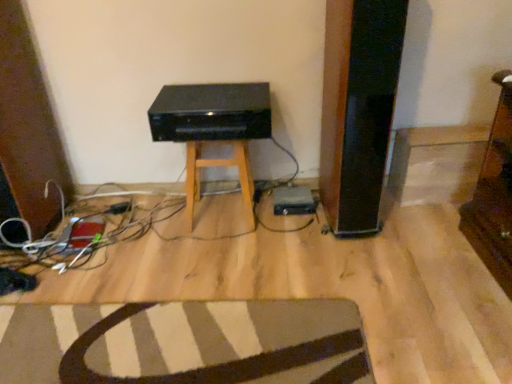
Question: In the image, is striped fabric rug at lower center on the left side or the right side of black plastic stereo at center?

Choices:
 (A) left
 (B) right

Answer: (A)

Question: Looking at the image, does striped fabric rug at lower center seem bigger or smaller compared to black plastic stereo at center?

Choices:
 (A) big
 (B) small

Answer: (B)

Question: Estimate the real-world distances between objects in this image. Which object is closer to the black plastic plug at lower left?

Choices:
 (A) striped fabric rug at lower center
 (B) black matte stool at center
 (C) black plastic stereo at center

Answer: (B)

Question: Which object is positioned closest to the black matte stool at center?

Choices:
 (A) striped fabric rug at lower center
 (B) black plastic stereo at center
 (C) black plastic plug at lower left

Answer: (B)